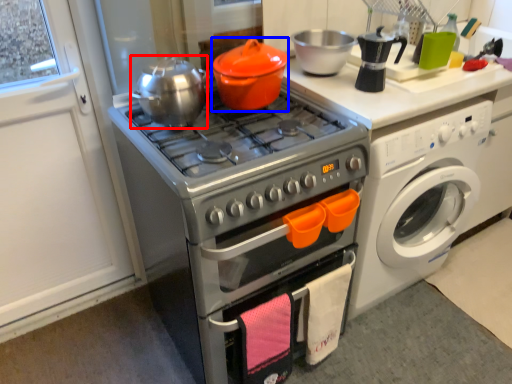
Question: Among these objects, which one is farthest to the camera, tea pot (highlighted by a red box) or crock pot (highlighted by a blue box)?

Choices:
 (A) tea pot
 (B) crock pot

Answer: (B)